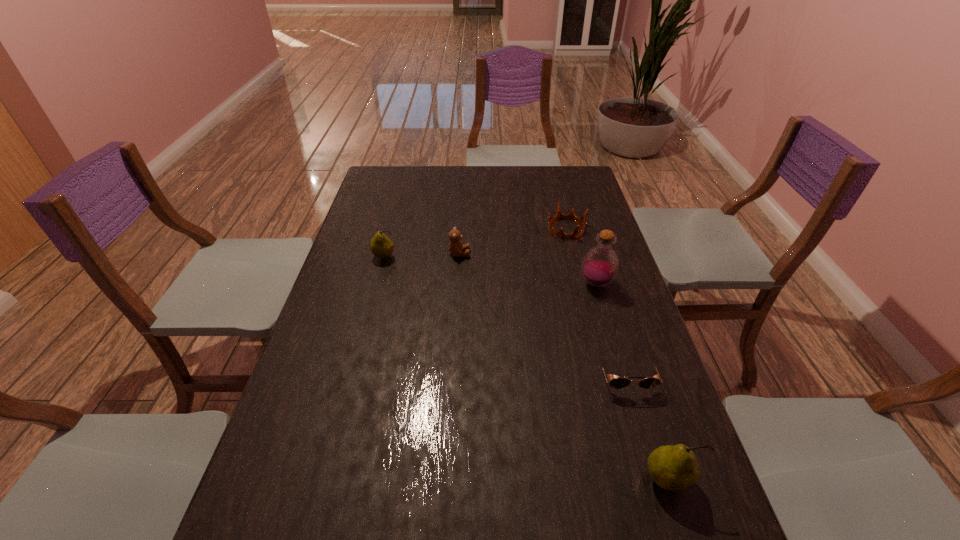
This screenshot has height=540, width=960. I want to click on sunglasses positioned at the right edge, so click(617, 383).

Identify the location of bottle situated at the right edge. The width and height of the screenshot is (960, 540). (600, 265).

I want to click on object that is at the near right corner, so click(x=672, y=468).

In the image, there is a desktop. What are the coordinates of `vacant space at the far edge` in the screenshot? It's located at (442, 172).

This screenshot has width=960, height=540. In the image, there is a desktop. Find the location of `vacant space at the near edge`. vacant space at the near edge is located at coordinates (382, 524).

The width and height of the screenshot is (960, 540). What are the coordinates of `free region at the left edge of the desktop` in the screenshot? It's located at (396, 215).

You are a GUI agent. You are given a task and a screenshot of the screen. Output one action in this format:
    pyautogui.click(x=<x>, y=<y>)
    Task: Click on the vacant region at the right edge of the desktop
    
    Given the screenshot: What is the action you would take?
    pyautogui.click(x=600, y=231)

The height and width of the screenshot is (540, 960). What are the coordinates of `vacant position at the far left corner of the desktop` in the screenshot? It's located at (388, 166).

This screenshot has height=540, width=960. In the image, there is a desktop. What are the coordinates of `vacant region at the far right corner` in the screenshot? It's located at [546, 168].

In the image, there is a desktop. Identify the location of blank space at the near right corner. (697, 523).